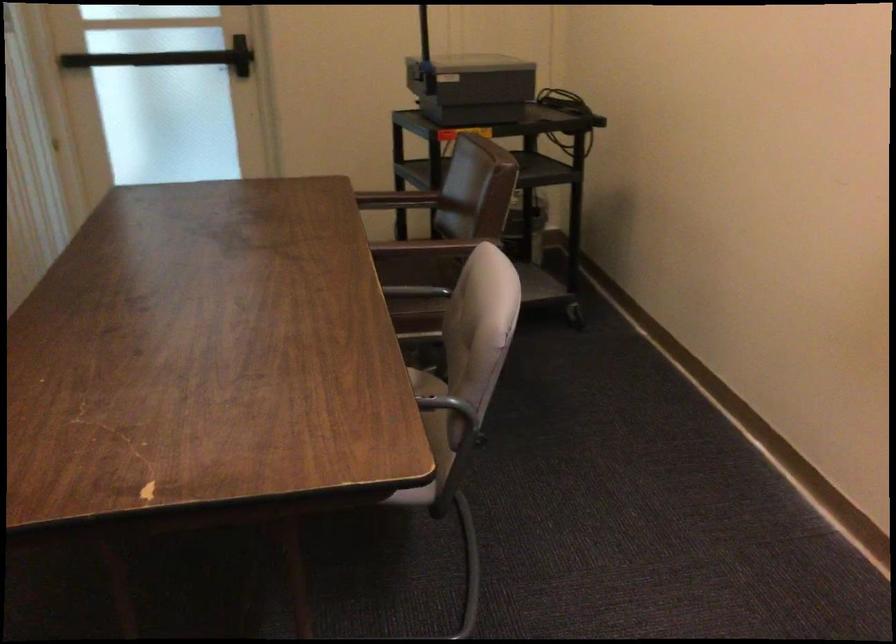
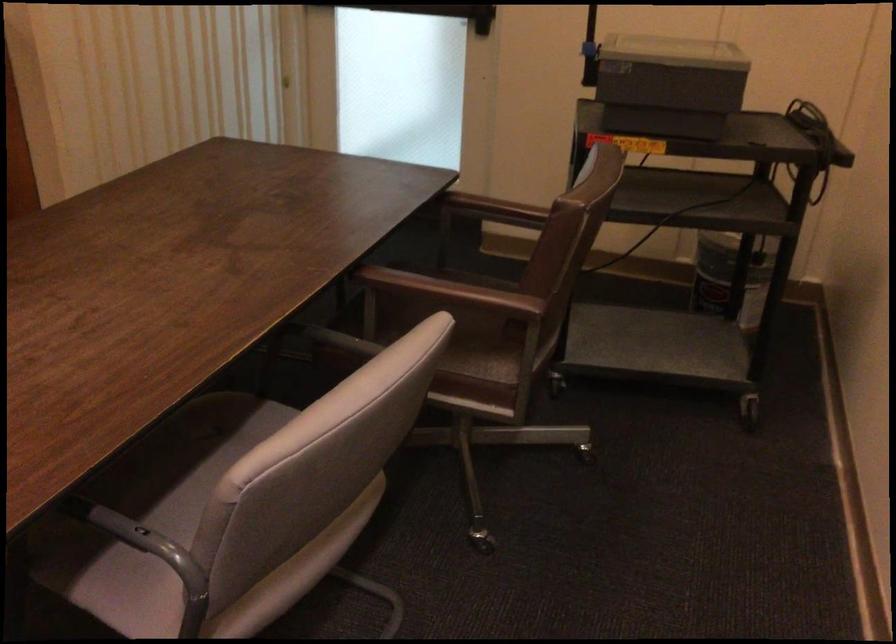
Question: The camera is either moving clockwise (left) or counter-clockwise (right) around the object. The first image is from the beginning of the video and the second image is from the end. Is the camera moving left or right when shooting the video?

Choices:
 (A) Left
 (B) Right

Answer: (B)